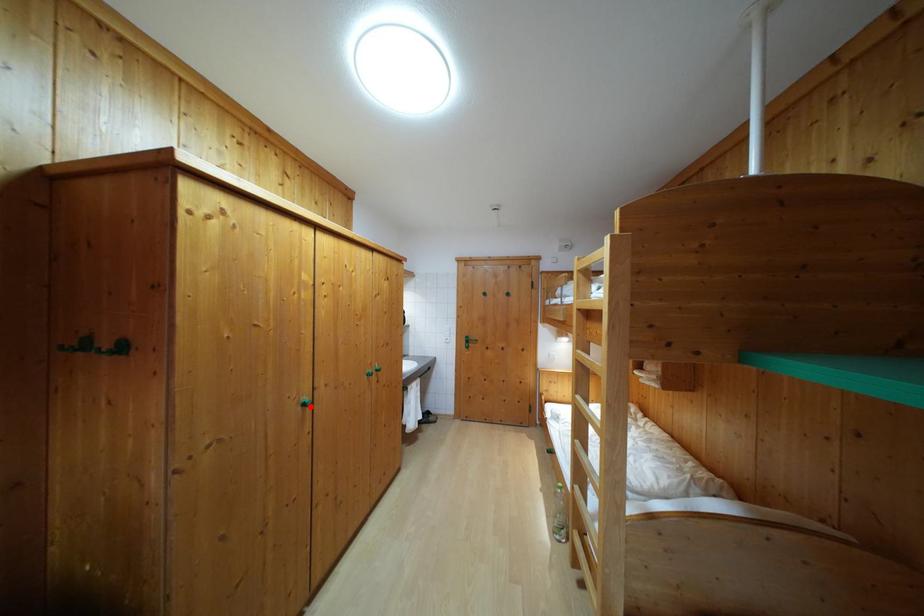
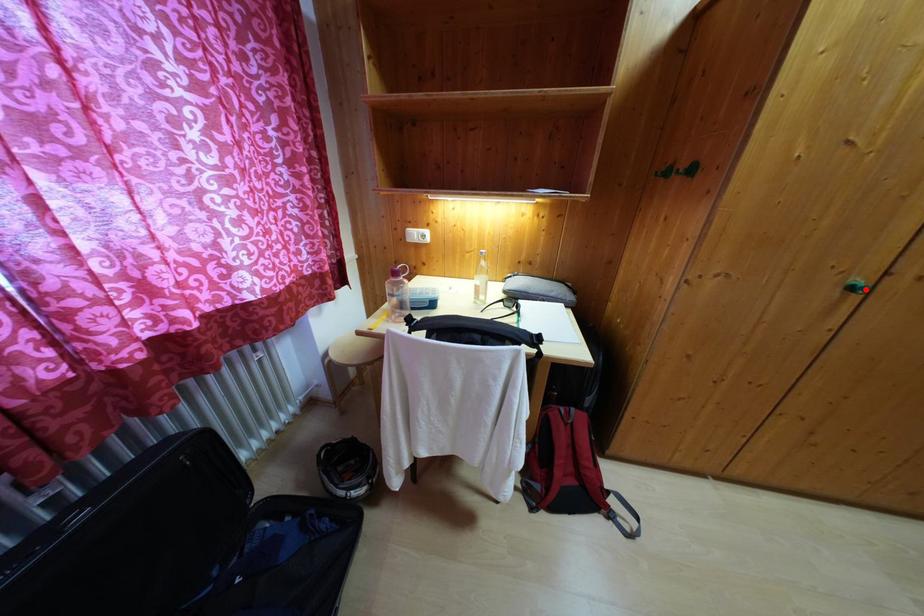
I am providing you with two images of the same scene from different viewpoints. A red point is marked on the first image and another point is marked on the second image. Is the marked point in image1 the same physical position as the marked point in image2?

Yes